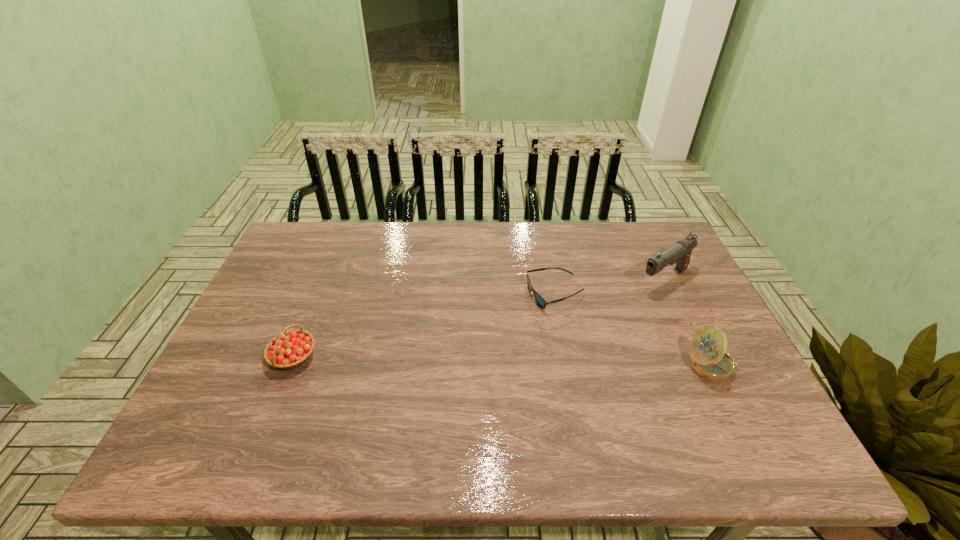
Where is `vacant space located at the front of the third object from right to left showing the lenses`? vacant space located at the front of the third object from right to left showing the lenses is located at coordinates (527, 325).

Where is `vacant position located at the front of the third object from right to left showing the lenses`? The height and width of the screenshot is (540, 960). vacant position located at the front of the third object from right to left showing the lenses is located at coordinates (478, 379).

Where is `free space located at the front of the third object from right to left showing the lenses`? This screenshot has width=960, height=540. free space located at the front of the third object from right to left showing the lenses is located at coordinates (460, 399).

This screenshot has width=960, height=540. What are the coordinates of `object that is at the far edge` in the screenshot? It's located at (680, 253).

This screenshot has height=540, width=960. What are the coordinates of `object present at the left edge` in the screenshot? It's located at (290, 349).

The image size is (960, 540). Find the location of `compass located in the right edge section of the desktop`. compass located in the right edge section of the desktop is located at coordinates (708, 358).

Identify the location of gun present at the right edge. The height and width of the screenshot is (540, 960). (680, 253).

Locate an element on the screen. This screenshot has height=540, width=960. object located at the far right corner is located at coordinates pyautogui.click(x=680, y=253).

Find the location of a particular element. The height and width of the screenshot is (540, 960). free location at the far edge of the desktop is located at coordinates (361, 231).

Locate an element on the screen. The width and height of the screenshot is (960, 540). blank space at the near edge is located at coordinates (486, 420).